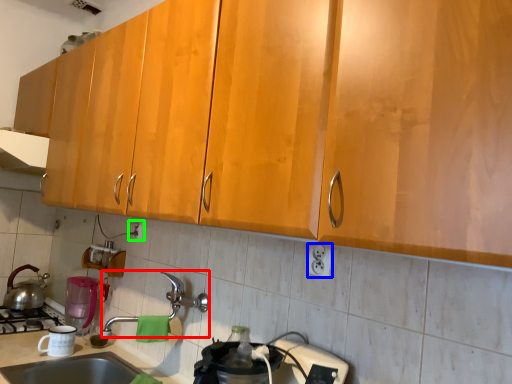
Question: Which is nearer to the faucet (highlighted by a red box)? electric outlet (highlighted by a blue box) or electric outlet (highlighted by a green box).

Choices:
 (A) electric outlet
 (B) electric outlet

Answer: (B)